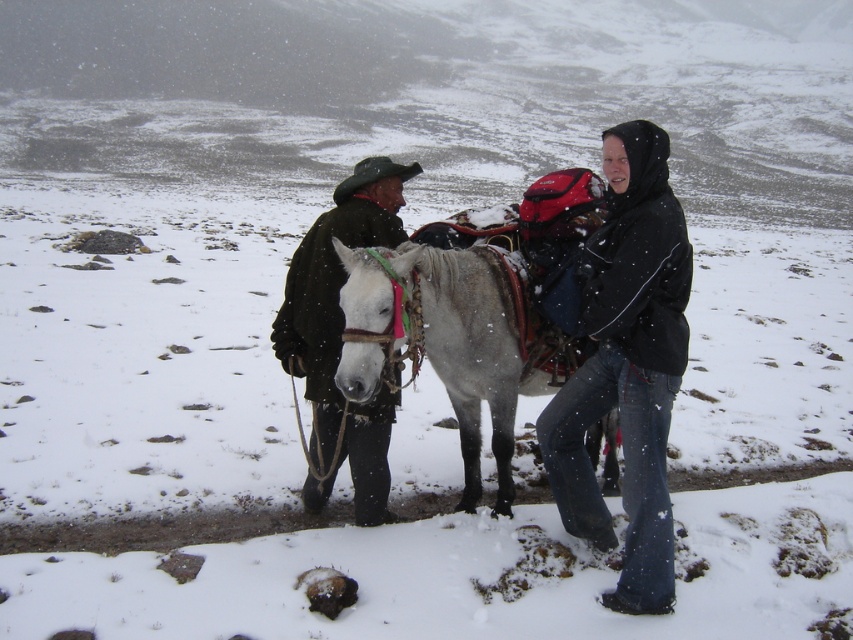
You are a photographer trying to capture the scene with the black matte jacket at center and the dark brown leather jacket at center. Which jacket is covering part of the other one?

The black matte jacket at center is positioned over dark brown leather jacket at center, so it is covering part of the dark brown leather jacket at center.

You are standing in the snowy landscape and want to know which object is lower in position between the matte black jacket at center and the white leather mule at center. According to the scene description, which one is lower?

The matte black jacket at center is positioned under the white leather mule at center, so the matte black jacket at center is lower.